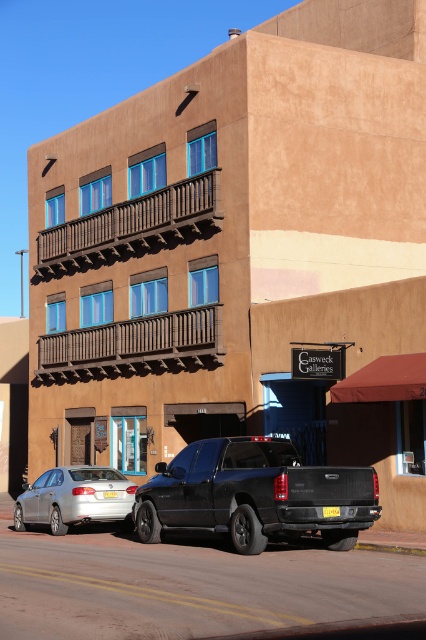
You are standing in front of the building and want to determine the relative positions of two points marked on its facade. Which point is closer to you, the point at coordinates (92, 472) or the point at (337, 515)?

The point at coordinates (92, 472) is closer to you because it is further to the viewer than the point at (337, 515).